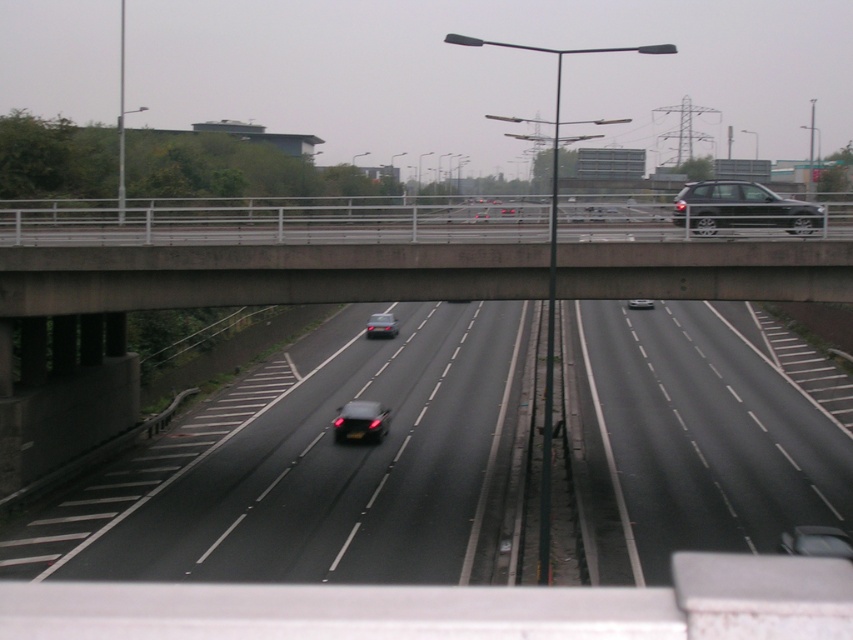
Question: Which object is closer to the camera taking this photo?

Choices:
 (A) shiny silver sedan at center
 (B) concrete bridge at center
 (C) shiny black sedan at center

Answer: (A)

Question: Is black asphalt highway at center positioned behind shiny silver sedan at center?

Choices:
 (A) no
 (B) yes

Answer: (A)

Question: Which object is the farthest from the shiny black sedan at center?

Choices:
 (A) shiny metallic car at right
 (B) concrete bridge at center
 (C) shiny silver sedan at center
 (D) shiny black car at center

Answer: (A)

Question: Among these points, which one is nearest to the camera?

Choices:
 (A) (790, 228)
 (B) (770, 288)
 (C) (520, 509)
 (D) (364, 404)

Answer: (A)

Question: Can you confirm if black asphalt highway at center is smaller than shiny black sedan at center?

Choices:
 (A) yes
 (B) no

Answer: (B)

Question: Observing the image, what is the correct spatial positioning of shiny black sedan at center in reference to shiny silver sedan at center?

Choices:
 (A) right
 (B) left

Answer: (B)